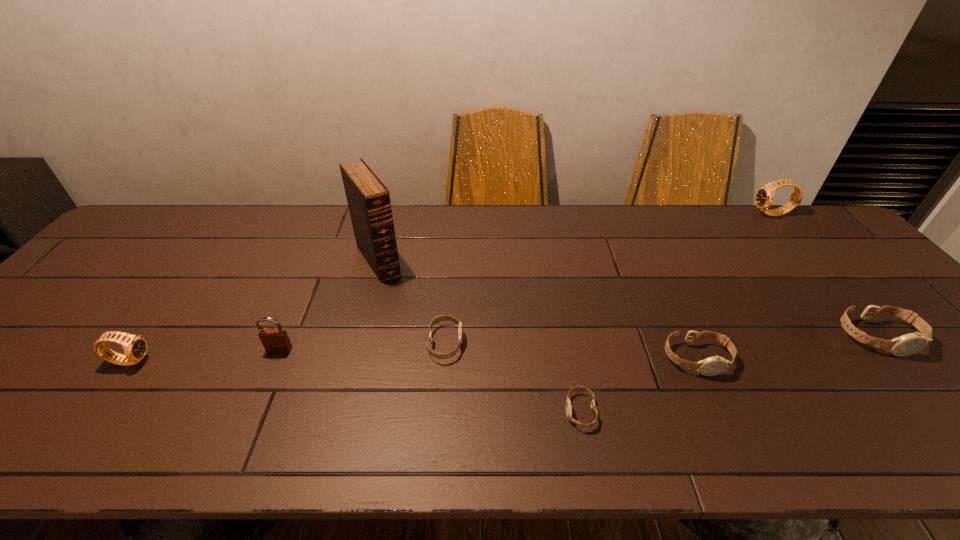
At what (x,y) coordinates should I click in order to perform the action: click on object that is at the near edge. Please return your answer as a coordinate pair (x, y). Looking at the image, I should click on tap(568, 403).

The image size is (960, 540). In order to click on object that is at the far right corner in this screenshot , I will do `click(764, 197)`.

I want to click on vacant space at the far edge of the desktop, so click(571, 211).

Find the location of `free space at the left edge of the desktop`. free space at the left edge of the desktop is located at coordinates (53, 349).

Where is `free space at the right edge of the desktop`? This screenshot has height=540, width=960. free space at the right edge of the desktop is located at coordinates (845, 262).

In the image, there is a desktop. At what (x,y) coordinates should I click in order to perform the action: click on vacant space at the near left corner. Please return your answer as a coordinate pair (x, y). Looking at the image, I should click on (12, 422).

Where is `unoccupied position between the seventh nearest object and the nearer black watch`? The width and height of the screenshot is (960, 540). unoccupied position between the seventh nearest object and the nearer black watch is located at coordinates (254, 310).

Where is `free space between the leftmost object and the nearest object`? free space between the leftmost object and the nearest object is located at coordinates (355, 386).

Locate an element on the screen. free space between the bigger black watch and the second smallest beige watch is located at coordinates (609, 279).

The width and height of the screenshot is (960, 540). I want to click on unoccupied position between the second farthest object and the leftmost object, so click(x=254, y=310).